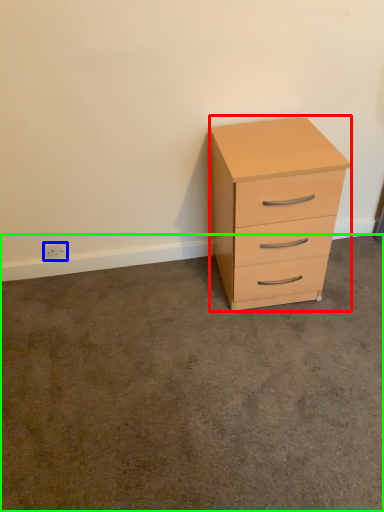
Question: Which object is positioned farthest from chest of drawers (highlighted by a red box)? Select from electric outlet (highlighted by a blue box) and concrete (highlighted by a green box).

Choices:
 (A) electric outlet
 (B) concrete

Answer: (A)